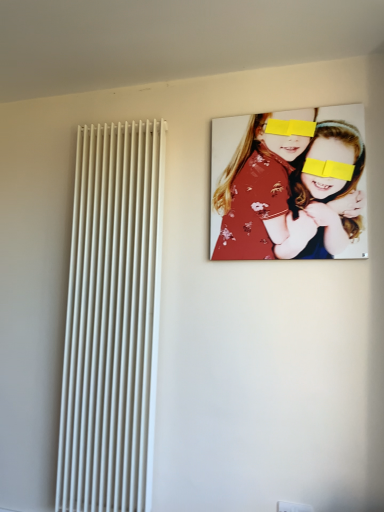
Question: Visually, is floral fabric portrait at upper right positioned to the left or to the right of white smooth radiator at left?

Choices:
 (A) right
 (B) left

Answer: (A)

Question: Is floral fabric portrait at upper right taller or shorter than white smooth radiator at left?

Choices:
 (A) tall
 (B) short

Answer: (B)

Question: Relative to white smooth radiator at left, is floral fabric portrait at upper right in front or behind?

Choices:
 (A) front
 (B) behind

Answer: (A)

Question: Does point (109, 309) appear closer or farther from the camera than point (324, 229)?

Choices:
 (A) closer
 (B) farther

Answer: (B)

Question: Is white smooth radiator at left in front of or behind floral fabric portrait at upper right in the image?

Choices:
 (A) behind
 (B) front

Answer: (A)

Question: Would you say white smooth radiator at left is inside or outside floral fabric portrait at upper right?

Choices:
 (A) inside
 (B) outside

Answer: (B)

Question: Based on their positions, is white smooth radiator at left located to the left or right of floral fabric portrait at upper right?

Choices:
 (A) left
 (B) right

Answer: (A)